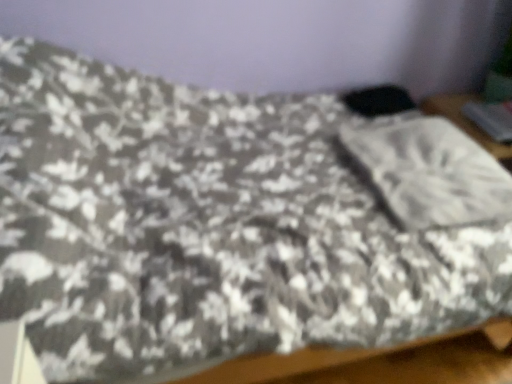
What do you see at coordinates (430, 172) in the screenshot? This screenshot has height=384, width=512. I see `white textured pillow at center` at bounding box center [430, 172].

Locate an element on the screen. Image resolution: width=512 pixels, height=384 pixels. white textured pillow at center is located at coordinates (430, 172).

This screenshot has width=512, height=384. What do you see at coordinates (490, 118) in the screenshot?
I see `metallic gray laptop at upper right` at bounding box center [490, 118].

Locate an element on the screen. The image size is (512, 384). metallic gray laptop at upper right is located at coordinates (490, 118).

Where is `white textured pillow at center`? white textured pillow at center is located at coordinates (430, 172).

Considering the positions of objects metallic gray laptop at upper right and white textured pillow at center in the image provided, who is more to the right, metallic gray laptop at upper right or white textured pillow at center?

metallic gray laptop at upper right is more to the right.

Is metallic gray laptop at upper right positioned before white textured pillow at center?

No, metallic gray laptop at upper right is further to the viewer.

Is point (478, 107) farther from camera compared to point (385, 200)?

Yes.

From the image's perspective, which one is positioned lower, metallic gray laptop at upper right or white textured pillow at center?

white textured pillow at center is shown below in the image.

From a real-world perspective, is metallic gray laptop at upper right physically located above or below white textured pillow at center?

Clearly, from a real-world perspective, metallic gray laptop at upper right is below white textured pillow at center.

Can you confirm if metallic gray laptop at upper right is thinner than white textured pillow at center?

Correct, the width of metallic gray laptop at upper right is less than that of white textured pillow at center.

Considering the sizes of objects metallic gray laptop at upper right and white textured pillow at center in the image provided, who is shorter, metallic gray laptop at upper right or white textured pillow at center?

Standing shorter between the two is metallic gray laptop at upper right.

Which of these two, metallic gray laptop at upper right or white textured pillow at center, is smaller?

With smaller size is metallic gray laptop at upper right.

Can white textured pillow at center be found inside metallic gray laptop at upper right?

Actually, white textured pillow at center is outside metallic gray laptop at upper right.

Is metallic gray laptop at upper right beside white textured pillow at center?

No, metallic gray laptop at upper right is not beside white textured pillow at center.

Does metallic gray laptop at upper right turn towards white textured pillow at center?

No, metallic gray laptop at upper right is not turned towards white textured pillow at center.

How much distance is there between metallic gray laptop at upper right and white textured pillow at center?

They are 58.69 centimeters apart.

Image resolution: width=512 pixels, height=384 pixels. I want to click on pillow on the left of metallic gray laptop at upper right, so click(x=430, y=172).

Is white textured pillow at center at the left side of metallic gray laptop at upper right?

Indeed, white textured pillow at center is positioned on the left side of metallic gray laptop at upper right.

Is the position of white textured pillow at center less distant than that of metallic gray laptop at upper right?

Yes, it is.

Is point (437, 147) positioned after point (495, 114)?

No.

From the image's perspective, relative to metallic gray laptop at upper right, is white textured pillow at center above or below?

Based on their image positions, white textured pillow at center is located beneath metallic gray laptop at upper right.

From a real-world perspective, is white textured pillow at center located beneath metallic gray laptop at upper right?

Incorrect, from a real-world perspective, white textured pillow at center is higher than metallic gray laptop at upper right.

Which object is thinner, white textured pillow at center or metallic gray laptop at upper right?

Thinner between the two is metallic gray laptop at upper right.

Based on the photo, considering the sizes of white textured pillow at center and metallic gray laptop at upper right in the image, is white textured pillow at center taller or shorter than metallic gray laptop at upper right?

In the image, white textured pillow at center appears to be taller than metallic gray laptop at upper right.

Who is smaller, white textured pillow at center or metallic gray laptop at upper right?

metallic gray laptop at upper right is smaller.

Do you think white textured pillow at center is within metallic gray laptop at upper right, or outside of it?

white textured pillow at center is not enclosed by metallic gray laptop at upper right.

Is the surface of white textured pillow at center in direct contact with metallic gray laptop at upper right?

No, white textured pillow at center is not next to metallic gray laptop at upper right.

Is white textured pillow at center aimed at metallic gray laptop at upper right?

Yes, white textured pillow at center is turned towards metallic gray laptop at upper right.

Can you tell me how much white textured pillow at center and metallic gray laptop at upper right differ in facing direction?

92.2 degrees.

In the image, there is a white textured pillow at center. Where is `silver below it (from a real-world perspective)`? The height and width of the screenshot is (384, 512). silver below it (from a real-world perspective) is located at coordinates (490, 118).

Identify the location of silver above the white textured pillow at center (from the image's perspective). The height and width of the screenshot is (384, 512). (490, 118).

At what (x,y) coordinates should I click in order to perform the action: click on silver on the right of the white textured pillow at center. Please return your answer as a coordinate pair (x, y). Looking at the image, I should click on (490, 118).